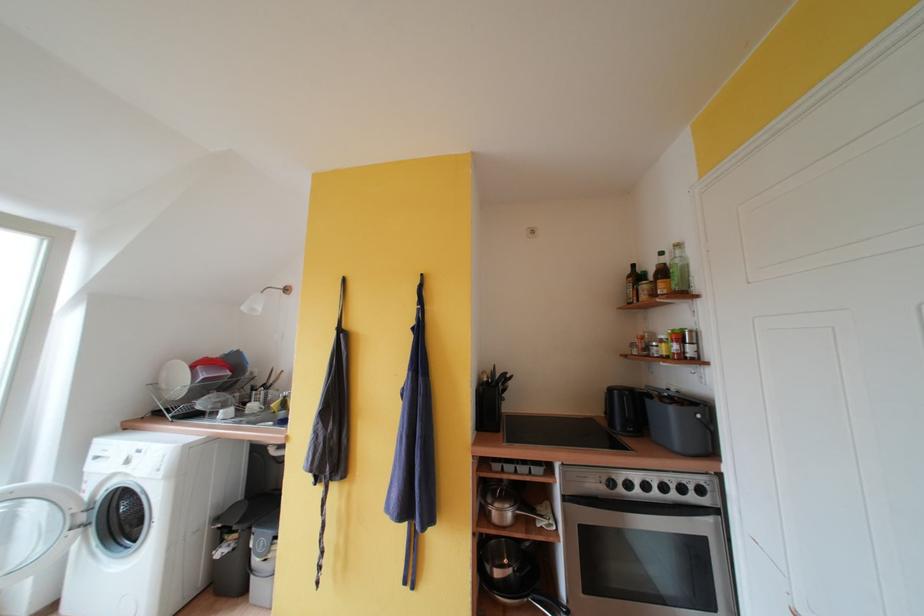
Where would you lift the red plastic container? Please return your answer as a coordinate pair (x, y).

(209, 370)